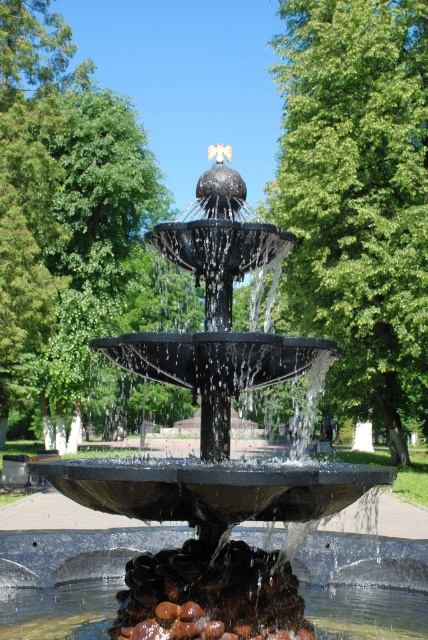
Which is above, green leafy tree at center or green leafy tree at upper center?

green leafy tree at center

From the picture: Is green leafy tree at center above green leafy tree at upper center?

Indeed, green leafy tree at center is positioned over green leafy tree at upper center.

Which is behind, point (347, 280) or point (45, 0)?

Point (45, 0)

The width and height of the screenshot is (428, 640). I want to click on green leafy tree at center, so click(x=357, y=196).